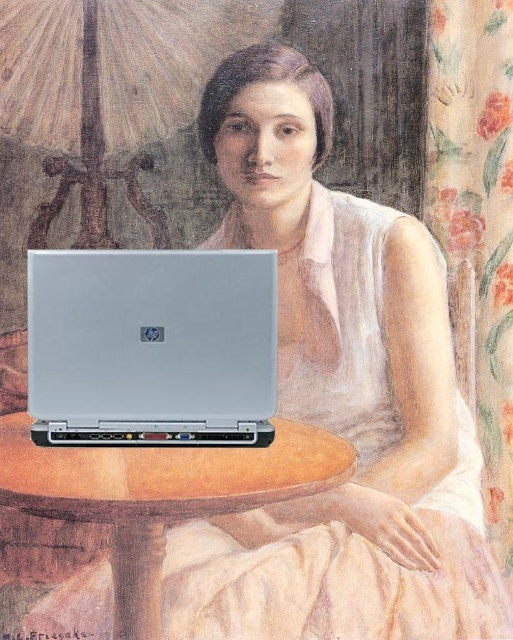
Does matte silver laptop at center have a greater height compared to silver metallic laptop at center?

Yes.

Between matte silver laptop at center and silver metallic laptop at center, which one is positioned higher?

matte silver laptop at center is above.

Is point (292, 360) more distant than point (58, 326)?

Yes, point (292, 360) is farther from viewer.

You are a GUI agent. You are given a task and a screenshot of the screen. Output one action in this format:
    pyautogui.click(x=<x>, y=<y>)
    Task: Click on the matte silver laptop at center
    
    Given the screenshot: What is the action you would take?
    pyautogui.click(x=339, y=400)

Based on the photo, does silver metallic laptop at center have a greater height compared to wooden round table at center?

Incorrect, silver metallic laptop at center's height is not larger of wooden round table at center's.

Who is more distant from viewer, [198,387] or [73,483]?

The point [198,387] is more distant.

In order to click on silver metallic laptop at center in this screenshot , I will do `click(151, 348)`.

Where is `matte silver laptop at center`? The width and height of the screenshot is (513, 640). matte silver laptop at center is located at coordinates (339, 400).

Can you confirm if matte silver laptop at center is positioned to the right of wooden round table at center?

Yes, matte silver laptop at center is to the right of wooden round table at center.

Between point (305, 230) and point (144, 522), which one is positioned in front?

Point (144, 522)

Find the location of a particular element. The height and width of the screenshot is (640, 513). matte silver laptop at center is located at coordinates (339, 400).